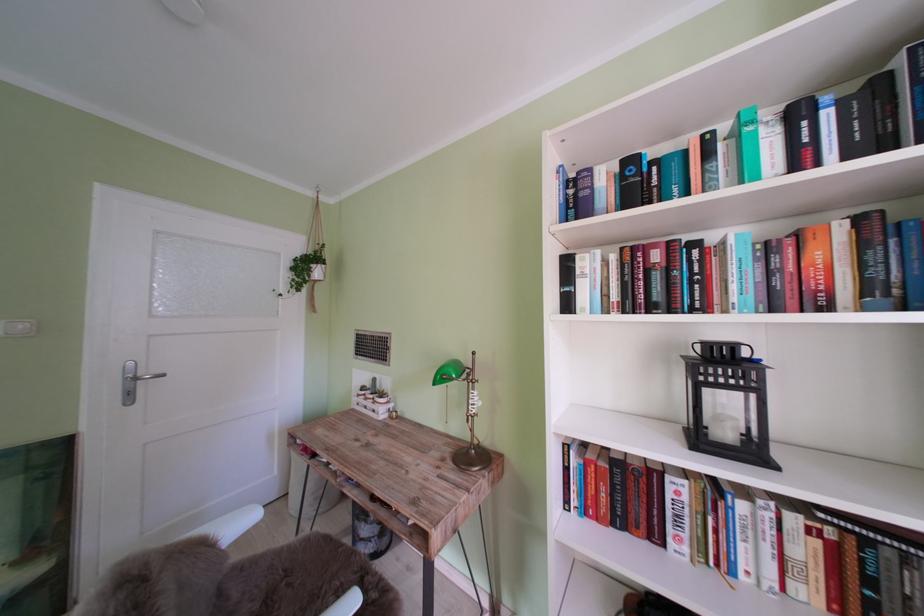
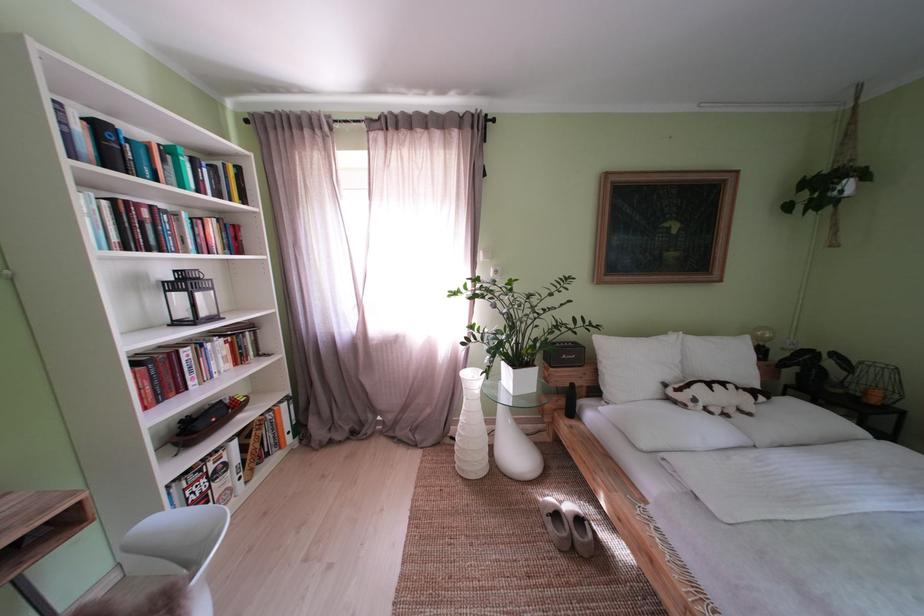
The point at (690, 493) is marked in the first image. Where is the corresponding point in the second image?

(199, 359)